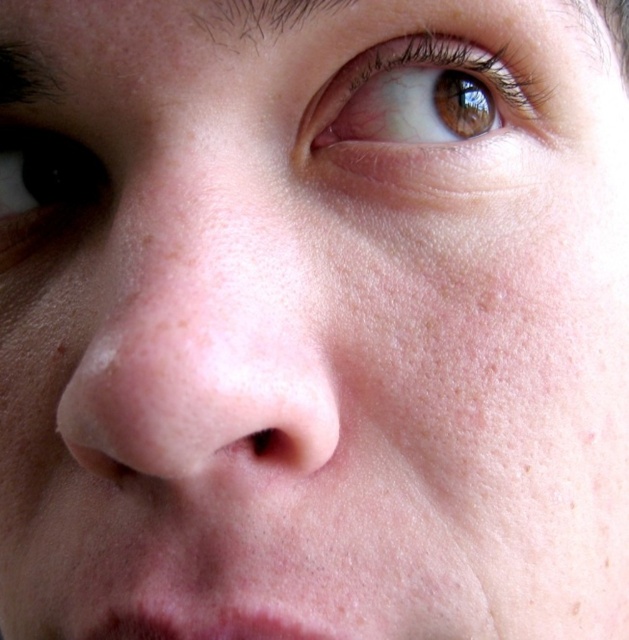
You are a makeup artist preparing to apply contouring to the pink smooth nose at center and the dark brown hair at upper left. Which object requires a smaller amount of product because of its size?

The dark brown hair at upper left requires a smaller amount of product because it has a smaller size compared to the pink smooth nose at center.

Based on the scene description, which object has a smaller width between the dark brown eye at upper left and the pink matte lips at lower center?

The dark brown eye at upper left has a smaller width than the pink matte lips at lower center.